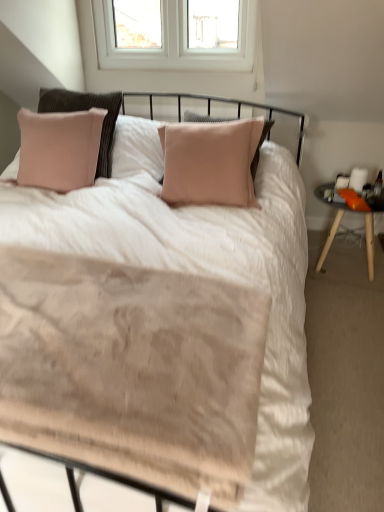
Question: Is orange fabric nightstand at right not within beige textured blanket at center?

Choices:
 (A) no
 (B) yes

Answer: (B)

Question: Considering the relative sizes of orange fabric nightstand at right and beige textured blanket at center in the image provided, is orange fabric nightstand at right smaller than beige textured blanket at center?

Choices:
 (A) yes
 (B) no

Answer: (B)

Question: Is orange fabric nightstand at right thinner than beige textured blanket at center?

Choices:
 (A) yes
 (B) no

Answer: (A)

Question: Is beige textured blanket at center inside orange fabric nightstand at right?

Choices:
 (A) yes
 (B) no

Answer: (B)

Question: Is the depth of orange fabric nightstand at right less than that of beige textured blanket at center?

Choices:
 (A) no
 (B) yes

Answer: (A)

Question: Does orange fabric nightstand at right appear on the left side of beige textured blanket at center?

Choices:
 (A) no
 (B) yes

Answer: (A)

Question: Is beige textured blanket at center facing away from orange fabric nightstand at right?

Choices:
 (A) no
 (B) yes

Answer: (A)

Question: Does beige textured blanket at center have a larger size compared to orange fabric nightstand at right?

Choices:
 (A) yes
 (B) no

Answer: (B)

Question: Is beige textured blanket at center positioned in front of orange fabric nightstand at right?

Choices:
 (A) yes
 (B) no

Answer: (A)

Question: Is beige textured blanket at center touching orange fabric nightstand at right?

Choices:
 (A) yes
 (B) no

Answer: (B)

Question: Is beige textured blanket at center taller than orange fabric nightstand at right?

Choices:
 (A) no
 (B) yes

Answer: (A)

Question: From the image's perspective, is beige textured blanket at center over orange fabric nightstand at right?

Choices:
 (A) yes
 (B) no

Answer: (B)

Question: Is beige textured blanket at center inside the boundaries of orange fabric nightstand at right, or outside?

Choices:
 (A) inside
 (B) outside

Answer: (B)